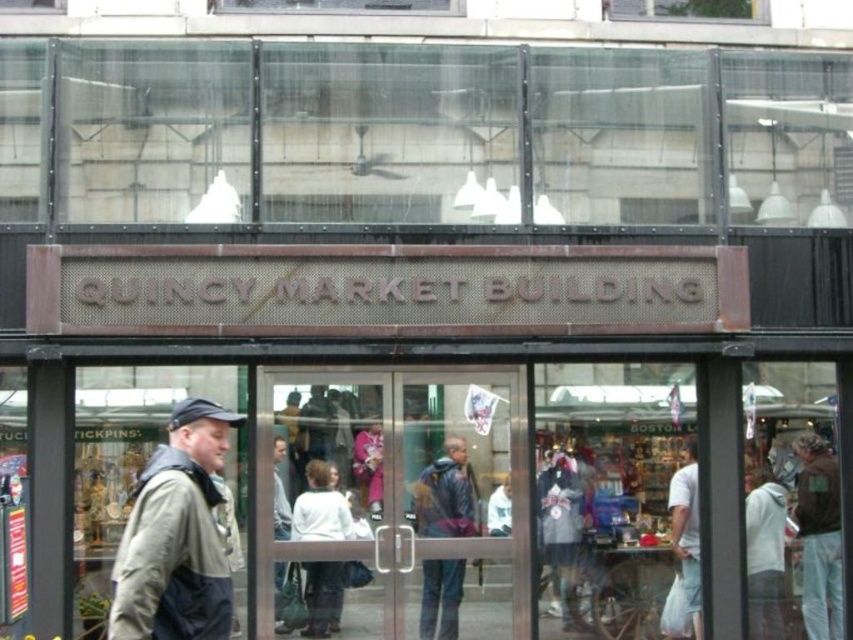
You are a customer at the Quincy Market Building entrance and want to pick up the khaki fabric jacket at left and the matte blue jacket at center. Which jacket do you need to move first to access the other?

The khaki fabric jacket at left is in front of the matte blue jacket at center, so you need to move the khaki fabric jacket at left first to access the matte blue jacket at center.

You are a delivery person carrying a khaki fabric jacket at left and need to enter the Quincy Market Building through the transparent glass door at center. Can you pass through the door without removing the jacket?

The transparent glass door at center might be wider than khaki fabric jacket at left, so there is a possibility that the delivery person can pass through the door without removing the jacket.

You are standing outside the Quincy Market Building and want to enter through the entrance. You see a transparent glass door at center and a khaki fabric jacket at left. Which object is positioned to the right of the other?

The transparent glass door at center is to the right of khaki fabric jacket at left.